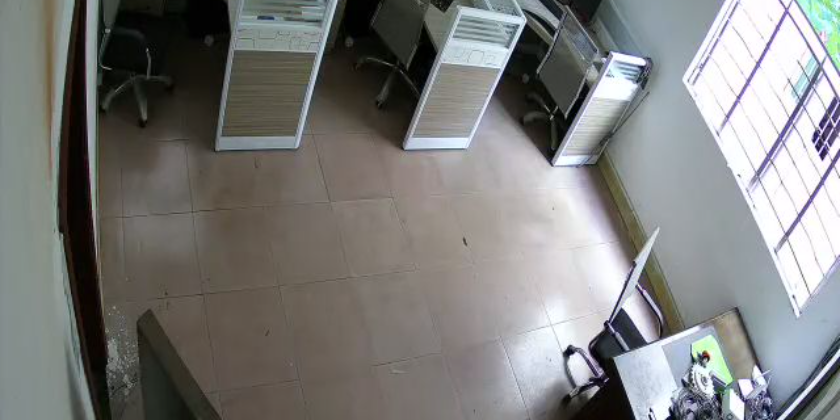
This screenshot has height=420, width=840. What are the coordinates of `cubicle wall` in the screenshot? It's located at (260, 115), (474, 101), (601, 119).